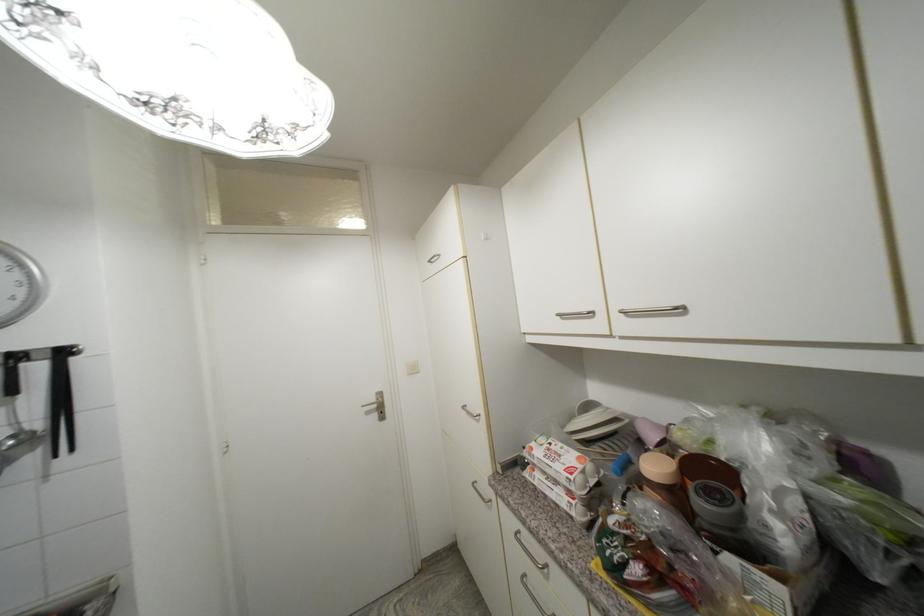
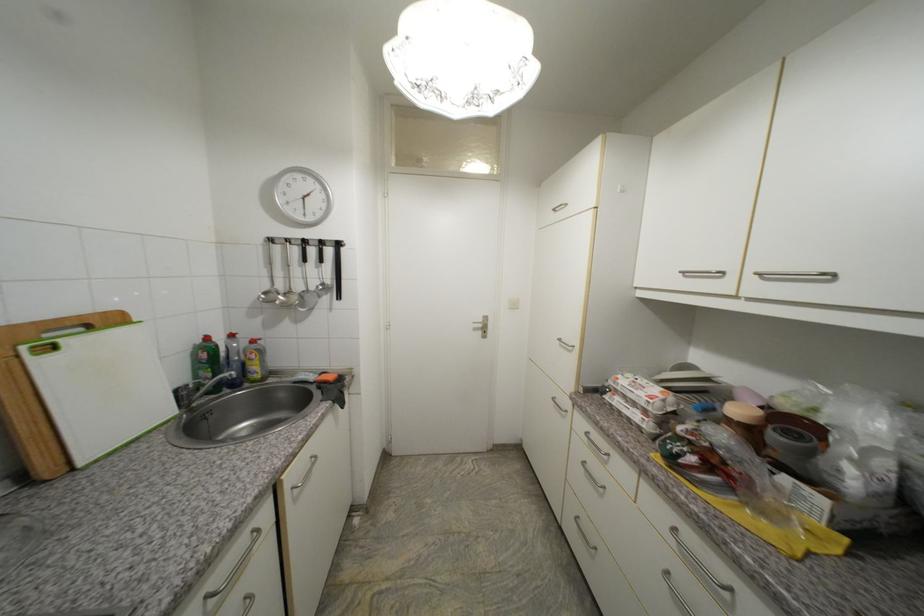
Find the pixel in the second image that matches (x=469, y=408) in the first image.

(565, 341)